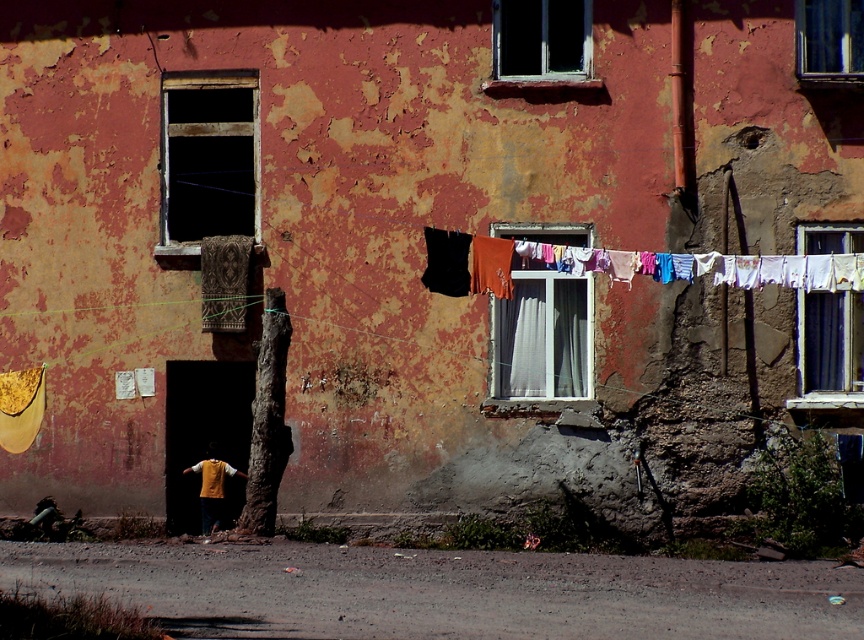
Question: From the image, what is the correct spatial relationship of multicolored fabric clothesline at center in relation to transparent glass window at upper center?

Choices:
 (A) below
 (B) above

Answer: (A)

Question: Which object is farther from the camera taking this photo?

Choices:
 (A) transparent glass window at upper center
 (B) white plastic window at center

Answer: (A)

Question: Which point is farther to the camera?

Choices:
 (A) (496, 4)
 (B) (847, 228)

Answer: (A)

Question: Which is farther from the white sheer curtain at upper right?

Choices:
 (A) transparent glass window at upper center
 (B) dark glass window at upper left
 (C) multicolored fabric clothesline at center

Answer: (B)

Question: Does multicolored fabric clothesline at center appear over white plastic window at center?

Choices:
 (A) yes
 (B) no

Answer: (A)

Question: From the image, what is the correct spatial relationship of white sheer curtain at upper right in relation to clear glass window at upper center?

Choices:
 (A) above
 (B) below

Answer: (B)